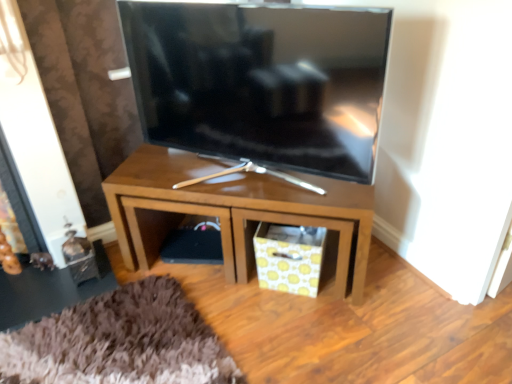
You are a GUI agent. You are given a task and a screenshot of the screen. Output one action in this format:
    pyautogui.click(x=<x>, y=<y>)
    Task: Click on the empty space that is in between wooden tv stand at center and yellow patterned paper at lower center
    
    Given the screenshot: What is the action you would take?
    pyautogui.click(x=239, y=291)